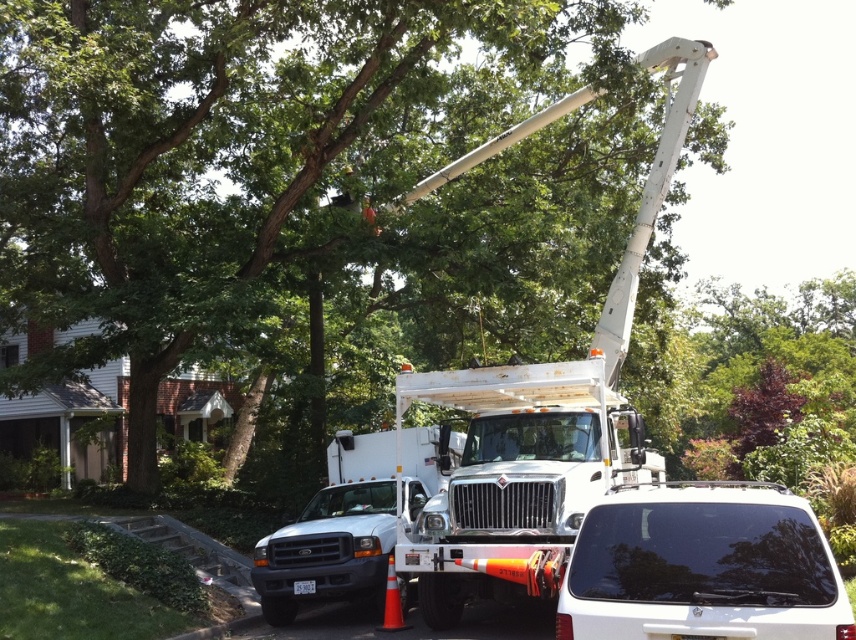
You are driving a car and see the image. You need to park your car behind the white metallic bucket truck at center without blocking the black glass suv at lower right. Is there enough space to park your car there?

The white metallic bucket truck at center is to the right of the black glass suv at lower right, so parking behind the white metallic bucket truck at center would not block the black glass suv at lower right as it is positioned to the right side.

You are a delivery driver who needs to park your vehicle between the black glass suv at lower right and the white matte truck at center. Can your vehicle, which is 2 meters wide, fit in the available space between them?

The black glass suv at lower right is narrower than the white matte truck at center, but the exact width between them isn not provided. However, since the suv is narrower than the truck, there might be enough space for a 2 meter wide vehicle. However, without precise measurements, it is uncertain.